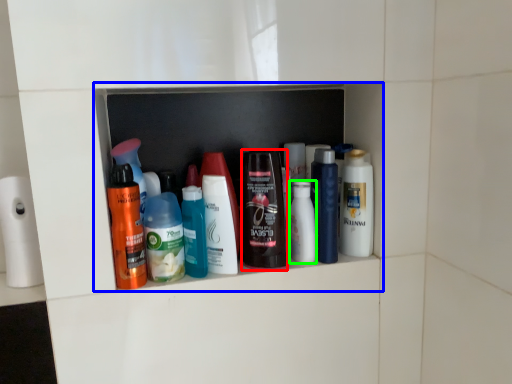
Question: Based on their relative distances, which object is nearer to toiletry (highlighted by a red box)? Choose from shelf (highlighted by a blue box) and toiletry (highlighted by a green box).

Choices:
 (A) shelf
 (B) toiletry

Answer: (B)